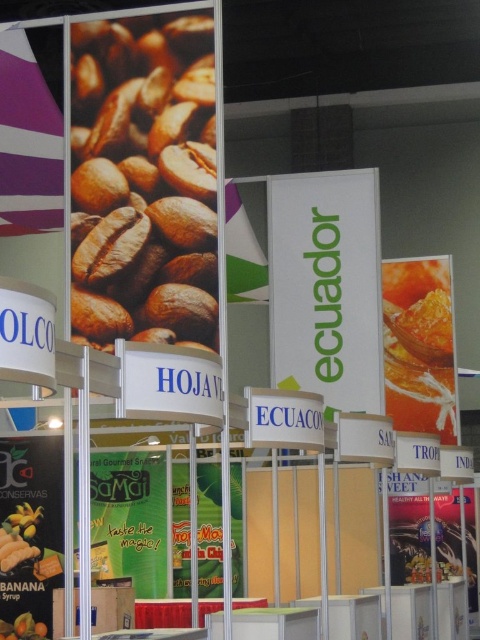
Question: Can you confirm if brown matte coffee beans at upper left is positioned to the left of yellow matte bananas at lower left?

Choices:
 (A) yes
 (B) no

Answer: (B)

Question: Which point appears closest to the camera in this image?

Choices:
 (A) (442, 417)
 (B) (9, 627)

Answer: (B)

Question: Which object is the closest to the brown matte coffee beans at upper left?

Choices:
 (A) shiny orange honeycomb at right
 (B) yellow matte bananas at lower left

Answer: (B)

Question: Estimate the real-world distances between objects in this image. Which object is farther from the brown matte coffee beans at upper left?

Choices:
 (A) green paper sign at center
 (B) yellow matte bananas at lower left

Answer: (B)

Question: Does yellow matte banana syrup at lower left lie behind yellow matte bananas at lower left?

Choices:
 (A) no
 (B) yes

Answer: (B)

Question: Does green paper sign at center have a smaller size compared to yellow matte banana syrup at lower left?

Choices:
 (A) yes
 (B) no

Answer: (B)